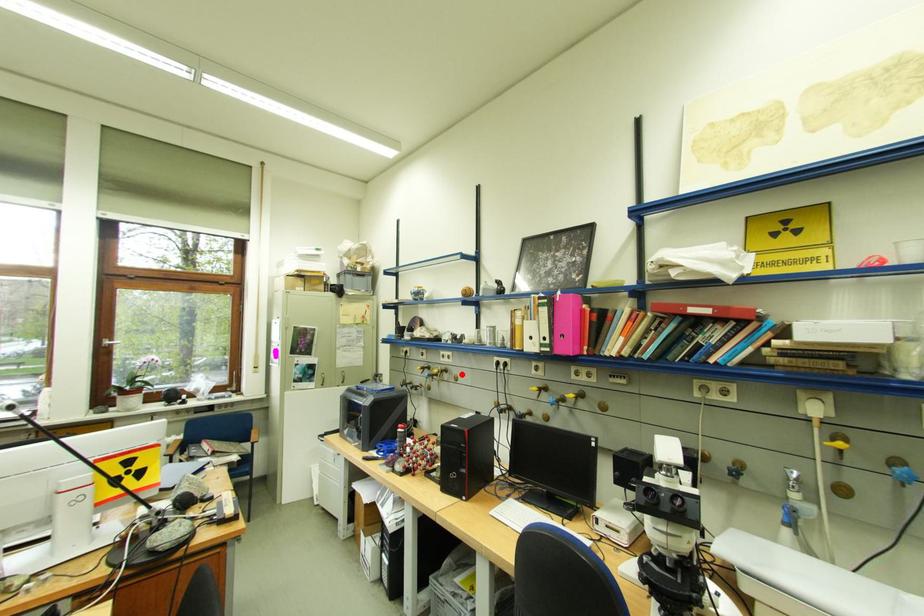
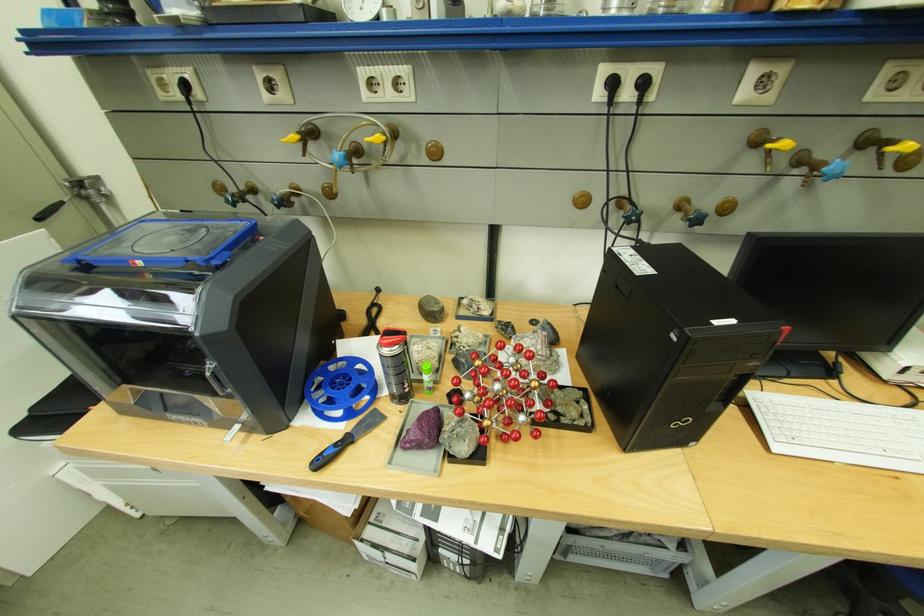
Question: I am providing you with two images of the same scene from different viewpoints. Given a red point in image1, look at the same physical point in image2. Is it:

Choices:
 (A) Closer to the viewpoint
 (B) Farther from the viewpoint

Answer: (A)